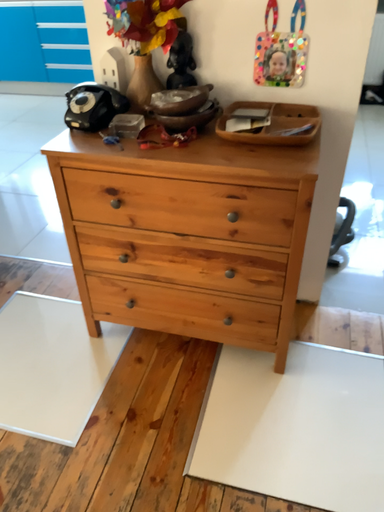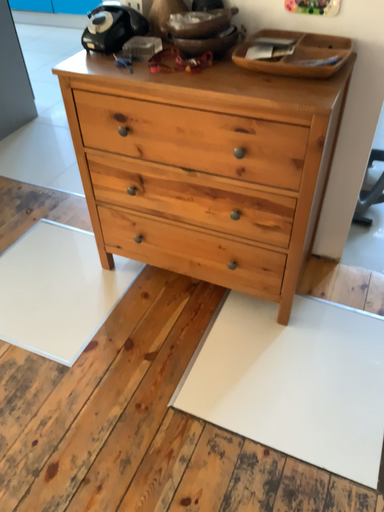
Question: Which way did the camera rotate in the video?

Choices:
 (A) rotated right
 (B) rotated left

Answer: (B)